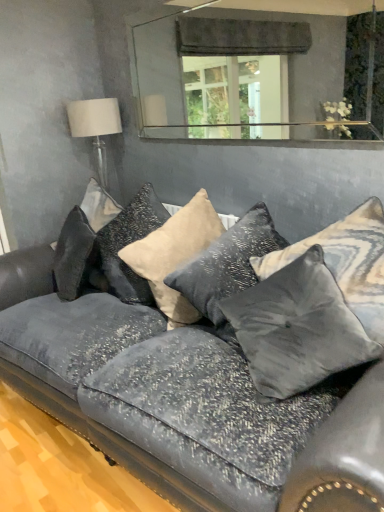
Question: From a real-world perspective, is velvet gray pillow at center, acting as the fourth pillow starting from the left, physically below white fabric lampshade at upper left?

Choices:
 (A) no
 (B) yes

Answer: (B)

Question: From a real-world perspective, is velvet gray pillow at center, arranged as the 2th pillow when viewed from the right, over white fabric lampshade at upper left?

Choices:
 (A) no
 (B) yes

Answer: (A)

Question: Is velvet gray pillow at center, arranged as the 2th pillow when viewed from the right, to the left of white fabric lampshade at upper left from the viewer's perspective?

Choices:
 (A) yes
 (B) no

Answer: (B)

Question: Is velvet gray pillow at center, acting as the fourth pillow starting from the left, far from white fabric lampshade at upper left?

Choices:
 (A) no
 (B) yes

Answer: (B)

Question: Is velvet gray pillow at center, acting as the fourth pillow starting from the left, directly adjacent to white fabric lampshade at upper left?

Choices:
 (A) yes
 (B) no

Answer: (B)

Question: Is velvet couch at center in front of or behind clear glass mirror at upper center in the image?

Choices:
 (A) front
 (B) behind

Answer: (A)

Question: Is point (273, 436) positioned closer to the camera than point (291, 110)?

Choices:
 (A) closer
 (B) farther

Answer: (A)

Question: From a real-world perspective, is velvet couch at center above or below clear glass mirror at upper center?

Choices:
 (A) below
 (B) above

Answer: (A)

Question: Is velvet couch at center inside the boundaries of clear glass mirror at upper center, or outside?

Choices:
 (A) inside
 (B) outside

Answer: (B)

Question: Would you say white fabric lampshade at upper left is to the left or to the right of velvet couch at center in the picture?

Choices:
 (A) right
 (B) left

Answer: (B)

Question: In terms of size, does white fabric lampshade at upper left appear bigger or smaller than velvet couch at center?

Choices:
 (A) small
 (B) big

Answer: (A)

Question: Does point (114, 108) appear closer or farther from the camera than point (339, 415)?

Choices:
 (A) closer
 (B) farther

Answer: (B)

Question: In terms of height, does white fabric lampshade at upper left look taller or shorter compared to velvet couch at center?

Choices:
 (A) tall
 (B) short

Answer: (B)

Question: Considering the relative positions of satin gray pillow at center, the 3th pillow when ordered from left to right, and satin beige pillow at center, the 4th pillow in the right-to-left sequence, in the image provided, is satin gray pillow at center, the 3th pillow when ordered from left to right, to the left or to the right of satin beige pillow at center, the 4th pillow in the right-to-left sequence,?

Choices:
 (A) left
 (B) right

Answer: (B)

Question: Is satin gray pillow at center, which is counted as the 3th pillow, starting from the right, inside the boundaries of satin beige pillow at center, arranged as the second pillow when viewed from the left, or outside?

Choices:
 (A) outside
 (B) inside

Answer: (B)